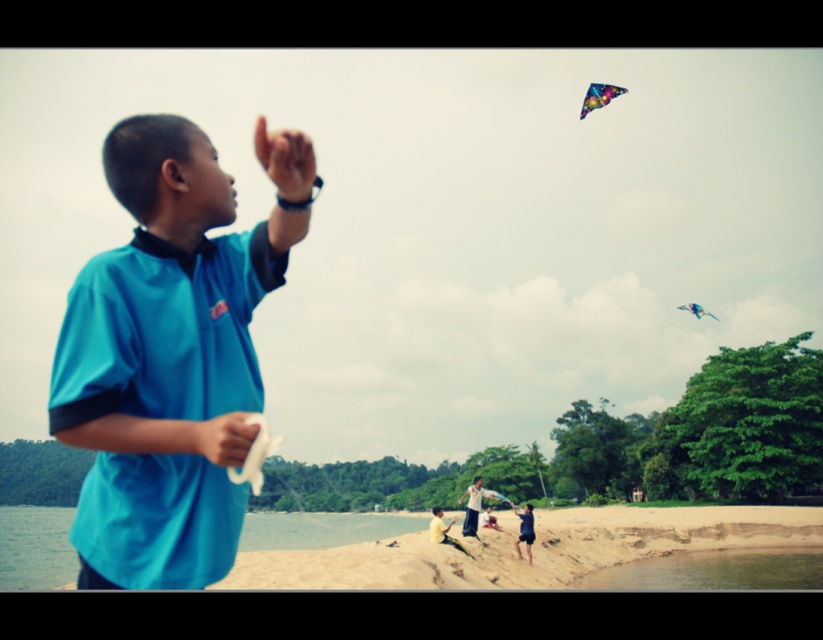
You are a photographer trying to capture the boy flying the kite. You notice a dark blue fabric pants at lower center located at point (524,529). Would positioning your camera to focus on the boy while avoiding the dark blue fabric pants at lower center require adjusting the camera angle upwards or downwards?

Since the dark blue fabric pants at lower center is at lower center, positioning the camera to focus on the boy while avoiding it would require adjusting the camera angle upwards.

You are standing on the beach and want to walk towards the clear water at lower right and the multicolored paper kite at upper right. Which object will you reach first?

You will reach the clear water at lower right first because it is closer to the viewer than the multicolored paper kite at upper right.